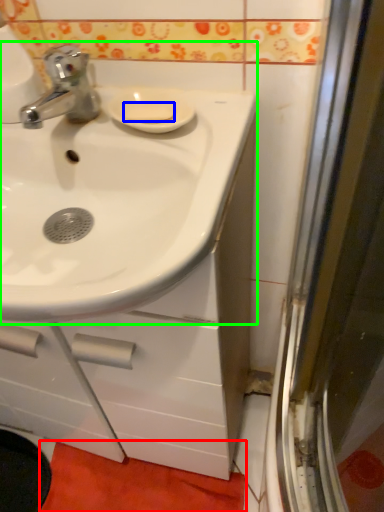
Question: Which object is the farthest from bath mat (highlighted by a red box)? Choose among these: soap (highlighted by a blue box) or sink (highlighted by a green box).

Choices:
 (A) soap
 (B) sink

Answer: (A)